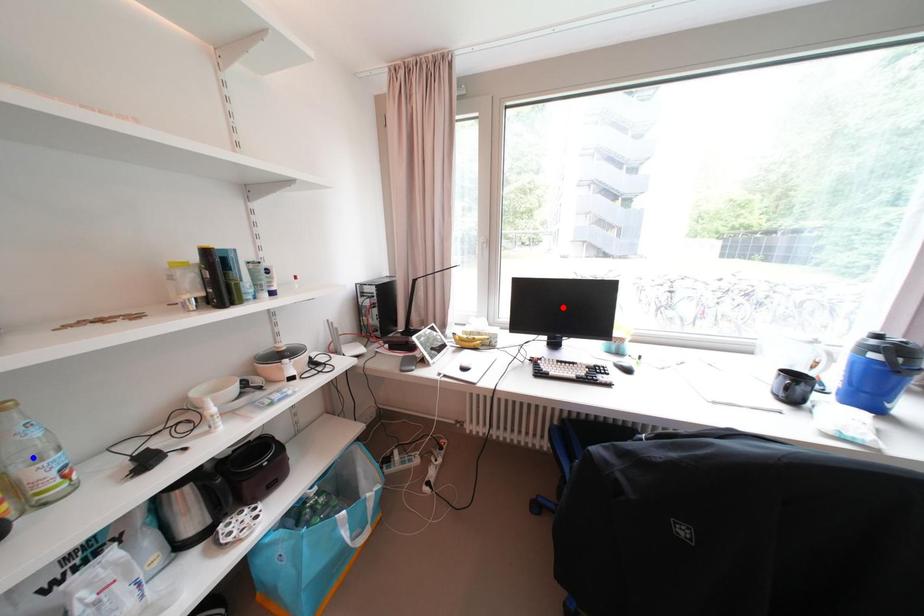
Question: Which of the two points in the image is closer to the camera?

Choices:
 (A) Blue point is closer.
 (B) Red point is closer.

Answer: (A)